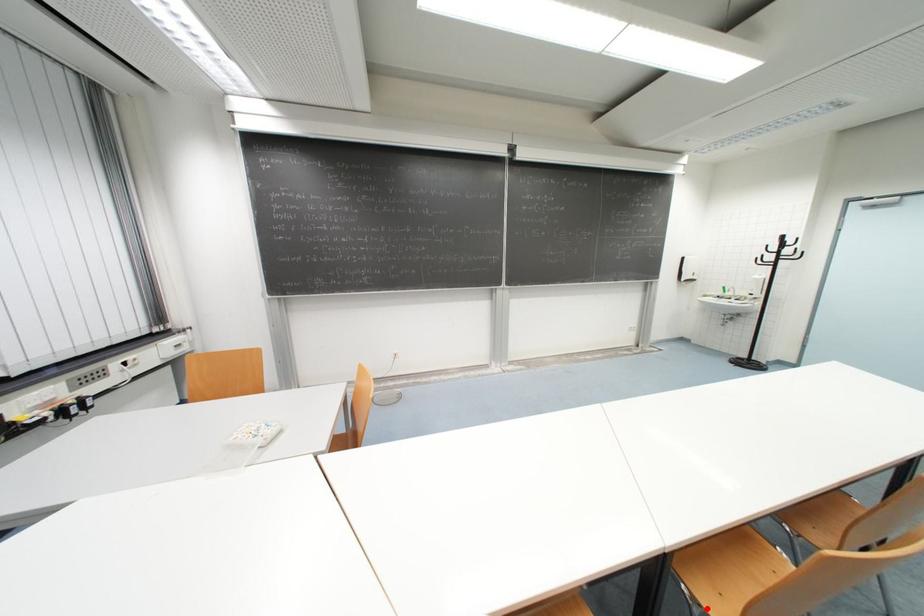
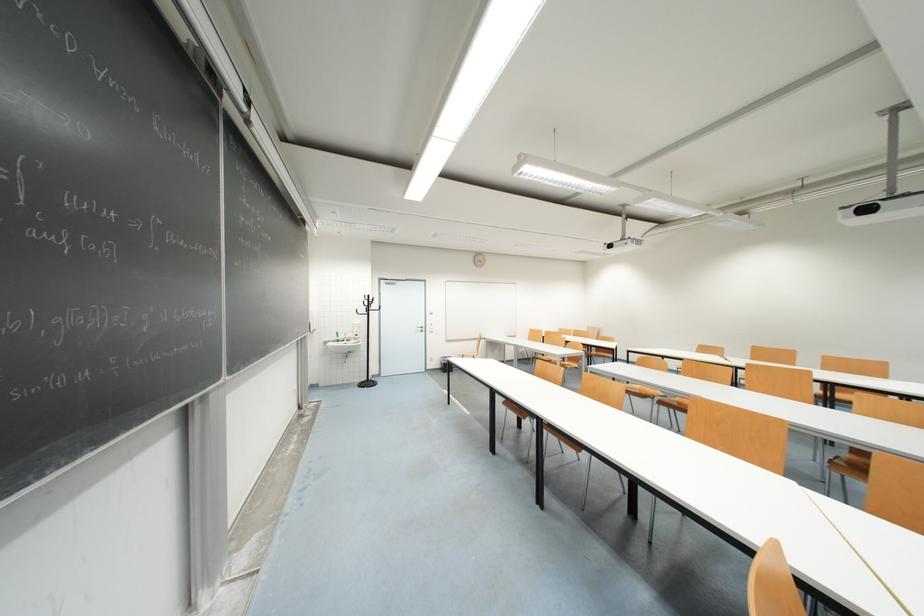
Question: I am providing you with two images of the same scene from different viewpoints. A red point is marked on the first image. At the location where the point appears in image 1, is it still visible in image 2?

Choices:
 (A) Yes
 (B) No

Answer: (B)